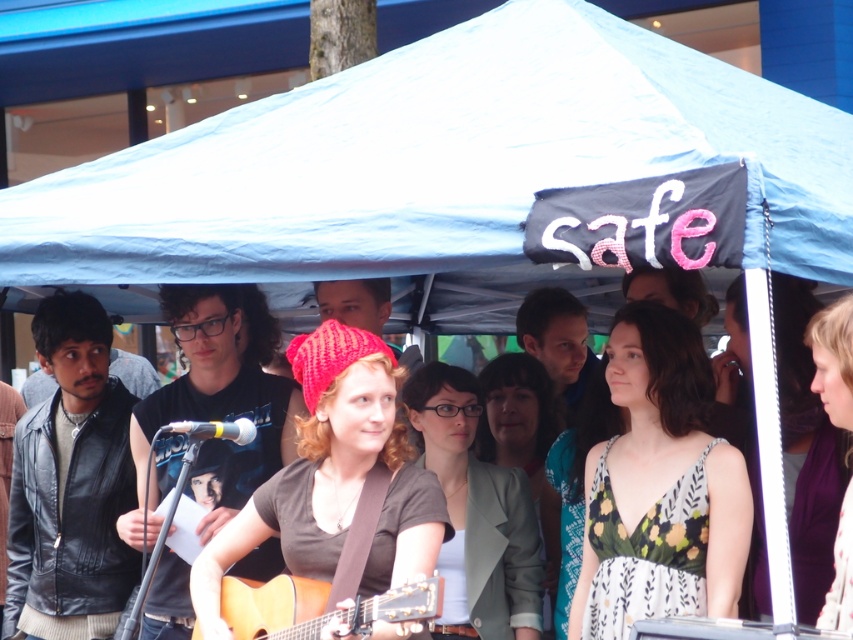
Is light gray fabric jacket at center taller than purple fabric dress at center?

Indeed, light gray fabric jacket at center has a greater height compared to purple fabric dress at center.

Who is more forward, (483,458) or (836,624)?

Point (836,624) is in front.

Is point (502, 444) positioned before point (842, 404)?

No, (502, 444) is behind (842, 404).

Locate an element on the screen. light gray fabric jacket at center is located at coordinates (524, 442).

Can you confirm if black t-shirt at center is positioned below purple fabric dress at center?

Actually, black t-shirt at center is above purple fabric dress at center.

Which is in front, point (198, 307) or point (825, 337)?

Point (825, 337) is in front.

The image size is (853, 640). In order to click on black t-shirt at center in this screenshot , I will do `click(216, 401)`.

Is point (535, 406) positioned before point (373, 291)?

No, it is not.

I want to click on light gray fabric jacket at center, so click(524, 442).

Locate an element on the screen. The width and height of the screenshot is (853, 640). light gray fabric jacket at center is located at coordinates (524, 442).